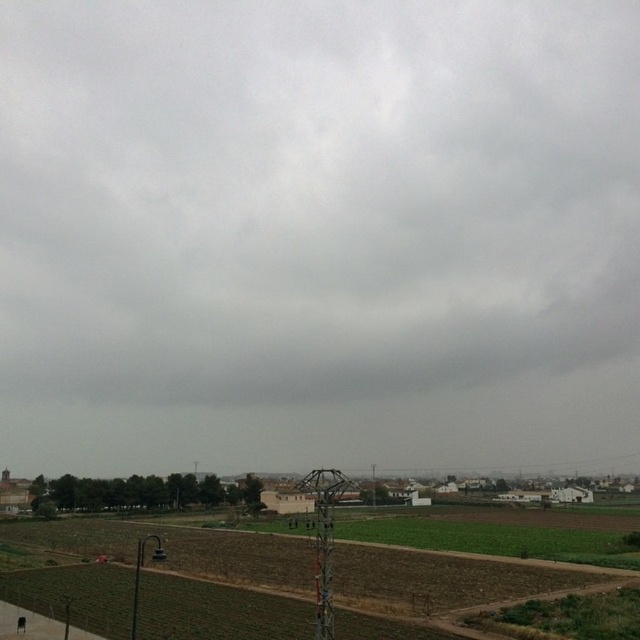
You are a farmer planning to plant crops in the brown soil at lower center. Considering the gray cloudy sky at upper center, what should you be cautious about?

The gray cloudy sky at upper center indicates an impending storm or cloudy weather, so you should be cautious about potential rain affecting the newly planted crops in the brown soil at lower center.

You are standing in the rural landscape and want to take a photo of the gray cloudy sky at upper center. Which direction should you aim your camera to capture it?

The gray cloudy sky at upper center is located at point 0.306 on the horizontal axis and 0.491 on the vertical axis. To capture it, aim your camera slightly to the right and center vertically.

You are standing in the rural landscape and want to walk from the point at coordinates point [280,275] to the point at coordinates point [113,586]. Which direction should you face to move towards the second point?

Since point [280,275] is further to the viewer than point [113,586], you should face towards the lower right direction to move from point [280,275] to point [113,586].